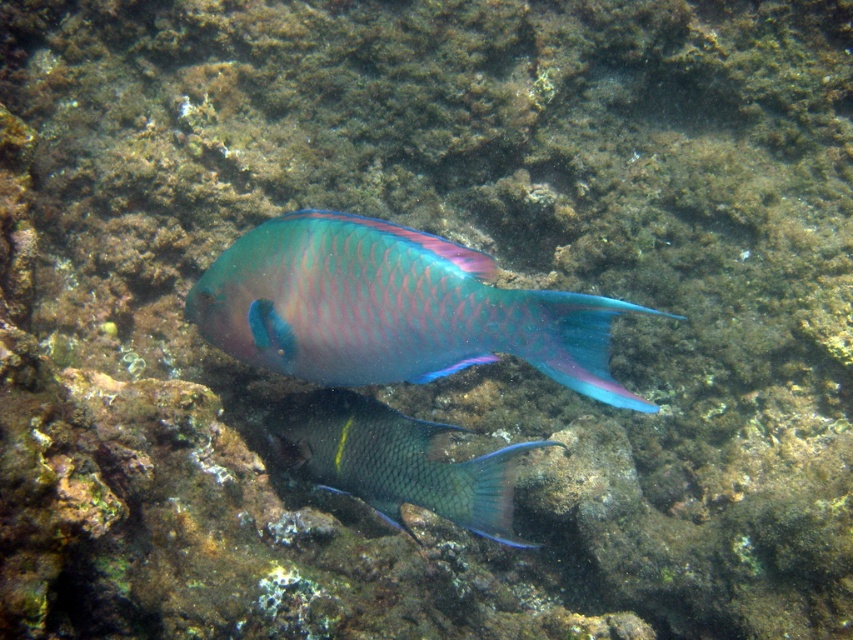
Question: Does metallic iridescent fish at center come in front of shiny blue-green fish at center?

Choices:
 (A) no
 (B) yes

Answer: (B)

Question: Among these objects, which one is farthest from the camera?

Choices:
 (A) shiny blue-green fish at center
 (B) metallic iridescent fish at center

Answer: (A)

Question: Which point is farther to the camera?

Choices:
 (A) shiny blue-green fish at center
 (B) metallic iridescent fish at center

Answer: (A)

Question: Is metallic iridescent fish at center to the left of shiny blue-green fish at center from the viewer's perspective?

Choices:
 (A) no
 (B) yes

Answer: (A)

Question: Can you confirm if metallic iridescent fish at center is positioned below shiny blue-green fish at center?

Choices:
 (A) yes
 (B) no

Answer: (B)

Question: Which point is farther to the camera?

Choices:
 (A) metallic iridescent fish at center
 (B) shiny blue-green fish at center

Answer: (B)